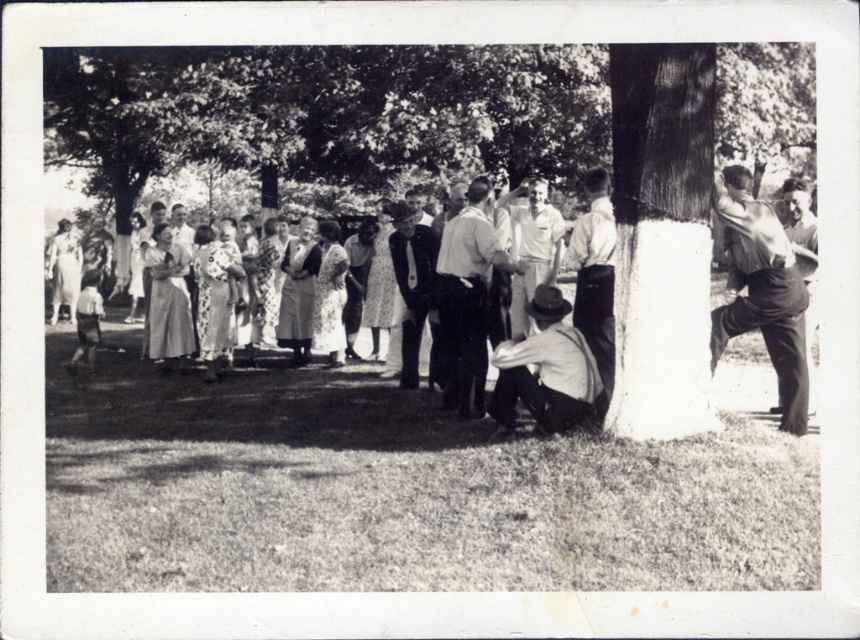
Based on the photo, does floral dress at center appear over matte brown hat at lower center?

Incorrect, floral dress at center is not positioned above matte brown hat at lower center.

Does point (732, 246) come behind point (588, 381)?

That is True.

This screenshot has height=640, width=860. I want to click on floral dress at center, so click(465, 339).

Looking at this image, does smooth brown suit at right lie behind matte brown hat at lower center?

No, it is not.

Between smooth brown suit at right and matte brown hat at lower center, which one has less height?

matte brown hat at lower center is shorter.

You are a GUI agent. You are given a task and a screenshot of the screen. Output one action in this format:
    pyautogui.click(x=<x>, y=<y>)
    Task: Click on the smooth brown suit at right
    
    Given the screenshot: What is the action you would take?
    pyautogui.click(x=760, y=291)

Can you confirm if floral dress at center is positioned to the right of smooth brown shirt at right?

In fact, floral dress at center is to the left of smooth brown shirt at right.

Does floral dress at center have a lesser height compared to smooth brown shirt at right?

Indeed, floral dress at center has a lesser height compared to smooth brown shirt at right.

Who is more distant from viewer, (108, 372) or (797, 227)?

The point (108, 372) is behind.

Locate an element on the screen. floral dress at center is located at coordinates [x=465, y=339].